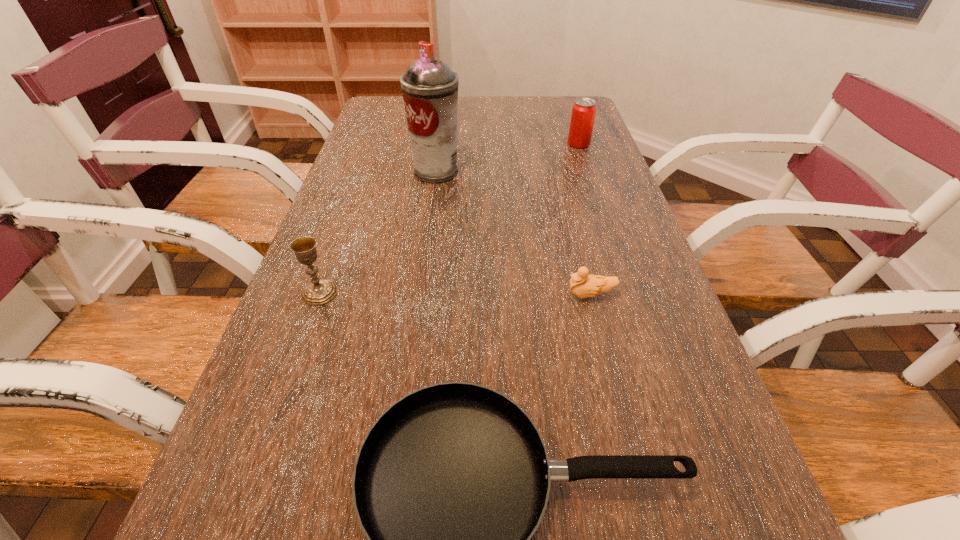
Identify the location of vacant area located on the face of the duckling. The height and width of the screenshot is (540, 960). (497, 295).

Image resolution: width=960 pixels, height=540 pixels. What are the coordinates of `object present at the left edge` in the screenshot? It's located at (319, 291).

Locate an element on the screen. This screenshot has width=960, height=540. can that is at the right edge is located at coordinates (584, 109).

This screenshot has height=540, width=960. I want to click on duckling positioned at the right edge, so click(x=583, y=285).

In the image, there is a desktop. Where is `vacant space at the far edge`? The image size is (960, 540). vacant space at the far edge is located at coordinates (506, 100).

I want to click on vacant space at the left edge of the desktop, so click(x=320, y=226).

Locate an element on the screen. This screenshot has height=540, width=960. vacant space at the right edge is located at coordinates (617, 177).

The height and width of the screenshot is (540, 960). Identify the location of vacant space at the far left corner of the desktop. click(388, 116).

The height and width of the screenshot is (540, 960). I want to click on free space between the leftmost object and the duckling, so click(x=455, y=294).

This screenshot has height=540, width=960. In order to click on free space between the second shortest object and the chalice in this screenshot , I will do `click(455, 294)`.